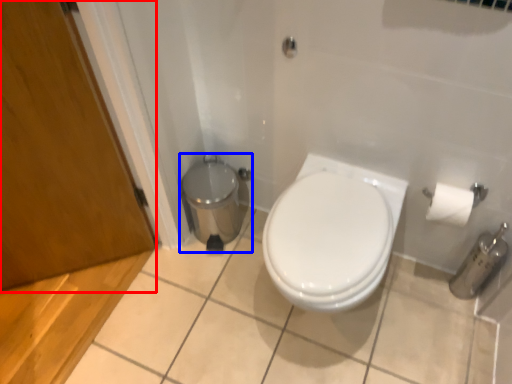
Question: Which object appears farthest to the camera in this image, screen door (highlighted by a red box) or porcelain (highlighted by a blue box)?

Choices:
 (A) screen door
 (B) porcelain

Answer: (B)